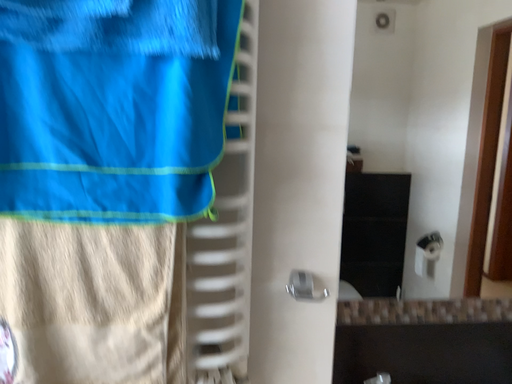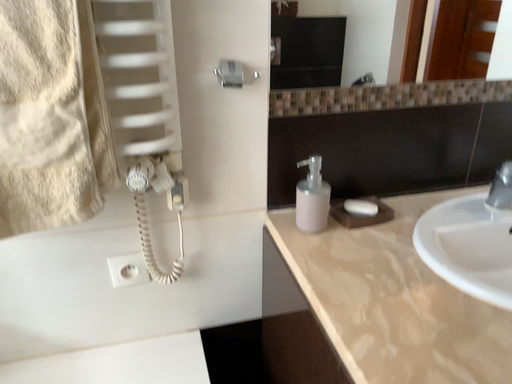
Question: How did the camera likely rotate when shooting the video?

Choices:
 (A) rotated left
 (B) rotated right

Answer: (B)